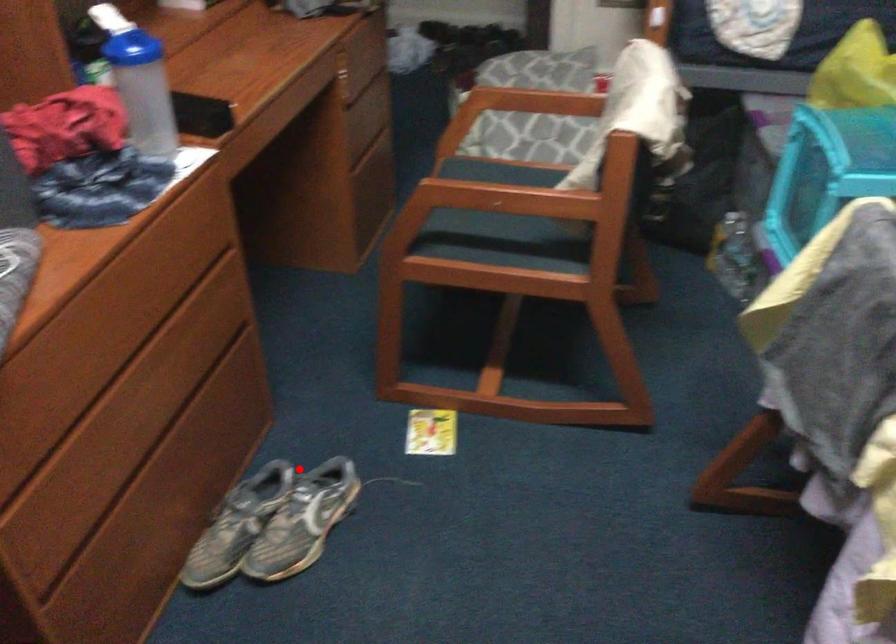
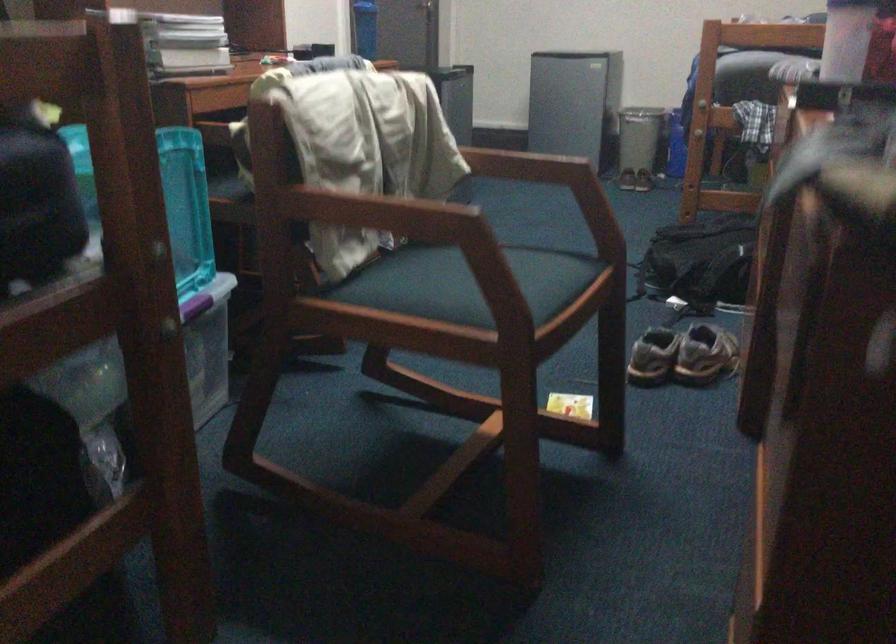
Question: I am providing you with two images of the same scene from different viewpoints. Given a red point in image1, look at the same physical point in image2. Is it:

Choices:
 (A) Closer to the viewpoint
 (B) Farther from the viewpoint

Answer: (B)